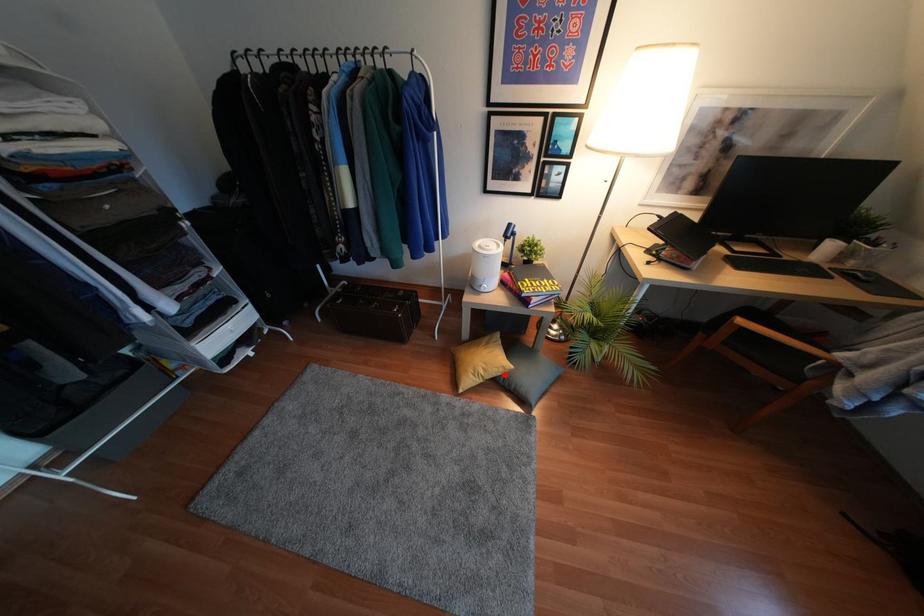
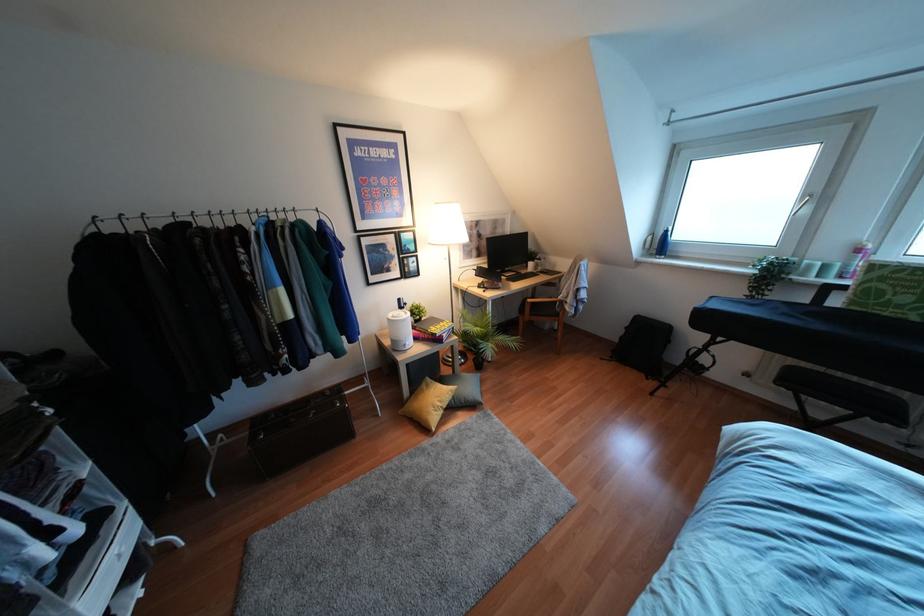
Question: I am providing you with two images of the same scene from different viewpoints. Image1 has a red point marked. In image2, the corresponding 3D location appears at what relative position? Reply with the corresponding letter.

Choices:
 (A) Closer
 (B) Farther

Answer: (A)